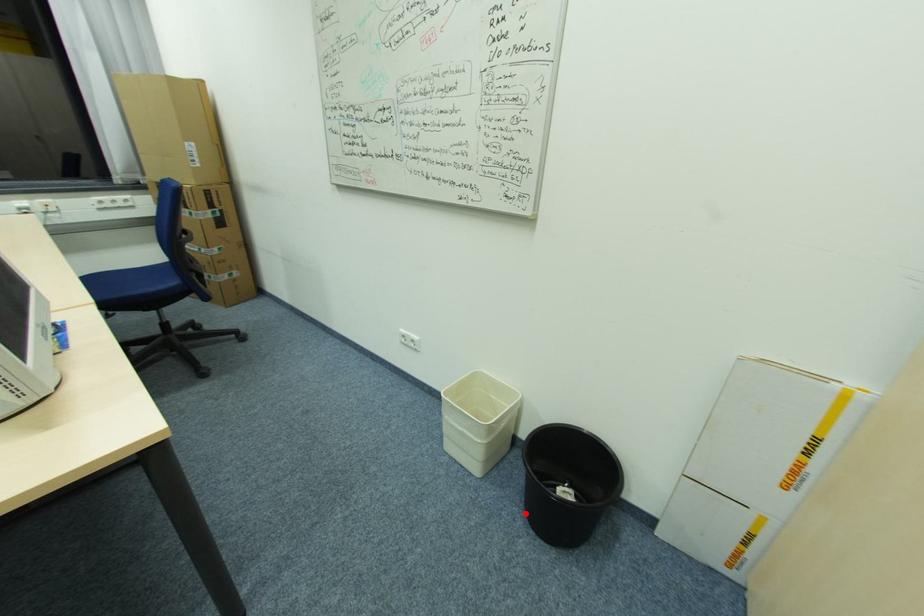
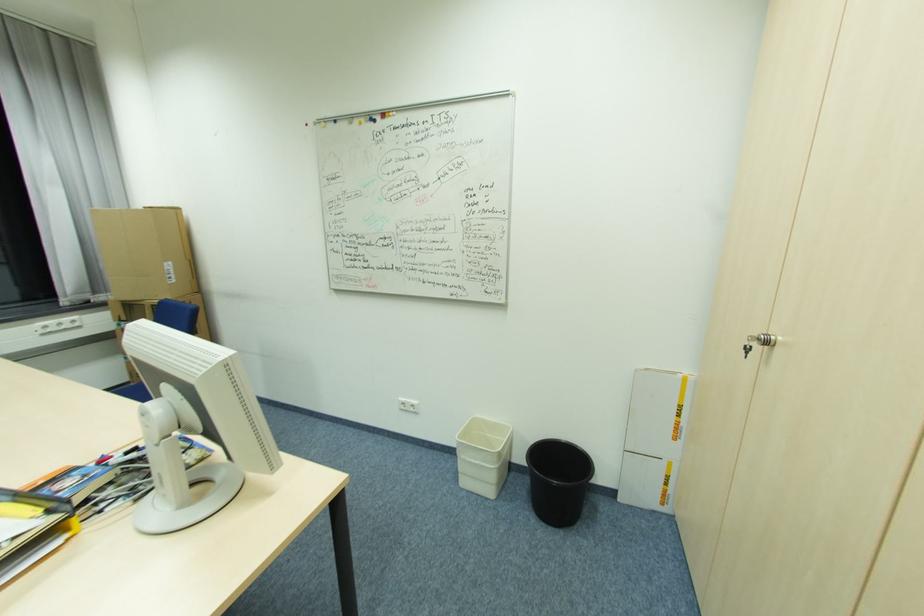
Locate, in the second image, the point that corresponds to the highlighted location in the first image.

(537, 515)